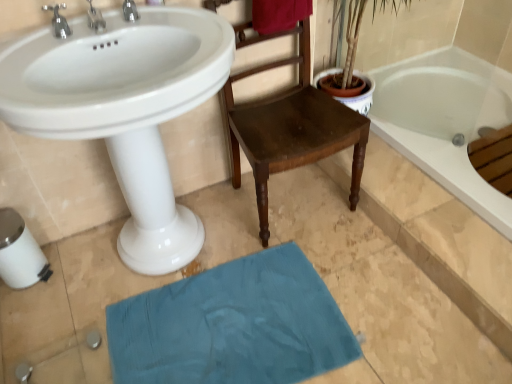
Question: Does silver metallic faucet at upper left, the second tap in the right-to-left sequence, contain silver metallic faucet at upper left, placed as the 1th tap when sorted from left to right?

Choices:
 (A) yes
 (B) no

Answer: (B)

Question: From a real-world perspective, is silver metallic faucet at upper left, the second tap in the right-to-left sequence, positioned over silver metallic faucet at upper left, placed as the 1th tap when sorted from left to right, based on gravity?

Choices:
 (A) no
 (B) yes

Answer: (A)

Question: Can you confirm if silver metallic faucet at upper left, the second tap from the left, is smaller than silver metallic faucet at upper left, placed as the 1th tap when sorted from left to right?

Choices:
 (A) no
 (B) yes

Answer: (B)

Question: Is silver metallic faucet at upper left, the second tap in the right-to-left sequence, turned away from silver metallic faucet at upper left, positioned as the 3th tap in right-to-left order?

Choices:
 (A) no
 (B) yes

Answer: (A)

Question: Would you consider silver metallic faucet at upper left, the second tap from the left, to be distant from silver metallic faucet at upper left, positioned as the 3th tap in right-to-left order?

Choices:
 (A) no
 (B) yes

Answer: (A)

Question: Is silver metallic faucet at upper left, the second tap from the left, to the left of silver metallic faucet at upper left, positioned as the 3th tap in right-to-left order, from the viewer's perspective?

Choices:
 (A) yes
 (B) no

Answer: (B)

Question: Is velvet red towel at upper center taller than wooden chair at center?

Choices:
 (A) no
 (B) yes

Answer: (A)

Question: Is velvet red towel at upper center located outside wooden chair at center?

Choices:
 (A) yes
 (B) no

Answer: (B)

Question: Considering the relative sizes of velvet red towel at upper center and wooden chair at center in the image provided, is velvet red towel at upper center shorter than wooden chair at center?

Choices:
 (A) no
 (B) yes

Answer: (B)

Question: Is velvet red towel at upper center aimed at wooden chair at center?

Choices:
 (A) yes
 (B) no

Answer: (A)

Question: Is velvet red towel at upper center looking in the opposite direction of wooden chair at center?

Choices:
 (A) yes
 (B) no

Answer: (A)

Question: From a real-world perspective, is velvet red towel at upper center physically above wooden chair at center?

Choices:
 (A) no
 (B) yes

Answer: (B)

Question: Does silver metallic faucet at upper left, the second tap in the right-to-left sequence, appear on the right side of teal fabric bath mat at lower center?

Choices:
 (A) no
 (B) yes

Answer: (A)